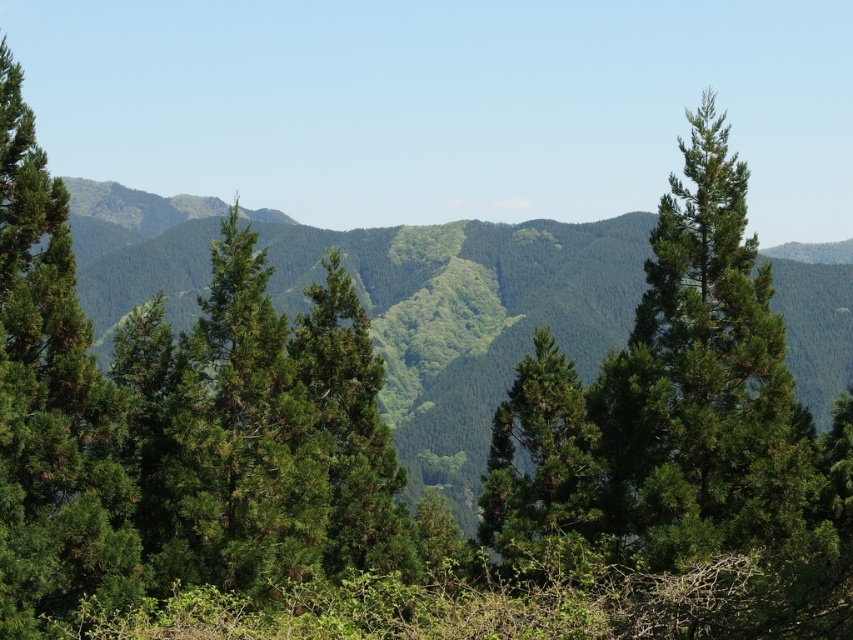
Question: Can you confirm if green matte tree at left is positioned to the right of green textured tree at center?

Choices:
 (A) yes
 (B) no

Answer: (B)

Question: Estimate the real-world distances between objects in this image. Which object is farther from the green textured tree at center?

Choices:
 (A) green matte tree at left
 (B) green matte tree at center

Answer: (B)

Question: Is green matte tree at left behind green matte tree at center?

Choices:
 (A) no
 (B) yes

Answer: (B)

Question: Which object is the farthest from the green matte tree at center?

Choices:
 (A) green matte tree at left
 (B) green textured tree at center

Answer: (A)

Question: Which point is farther to the camera?

Choices:
 (A) (218, 460)
 (B) (523, 516)
 (C) (32, 540)

Answer: (B)

Question: Does green matte tree at left appear over green matte tree at center?

Choices:
 (A) no
 (B) yes

Answer: (B)